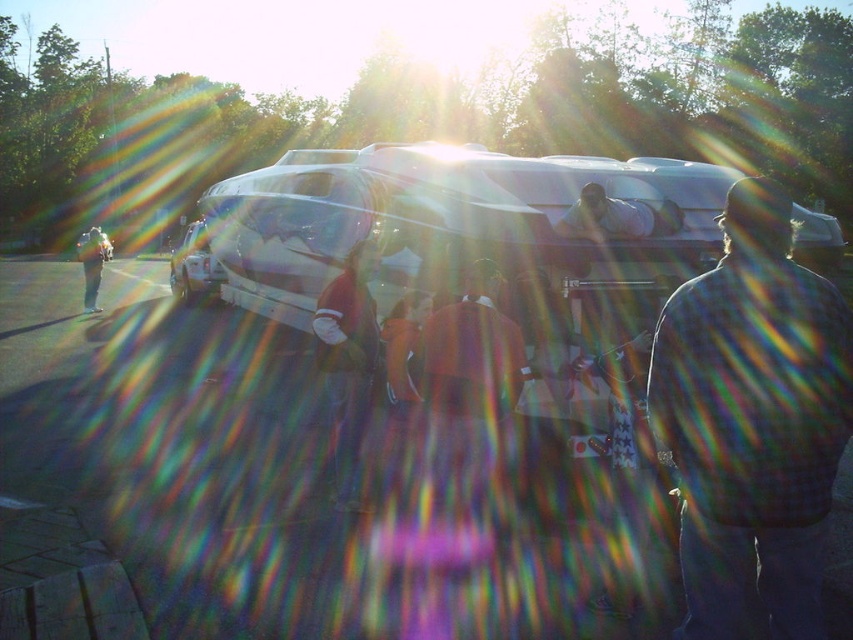
You are standing in the parking lot and see the orange fabric jacket at center and the light brown leather jacket at left. Which jacket is nearer to you?

The orange fabric jacket at center is closer to the viewer than the light brown leather jacket at left.

You are a photographer setting up a shoot in this outdoor evening scene. You have two props to place symmetrically on either side of the camera frame. The plaid shirt at right and the light brown leather jacket at left must be positioned so their edges align with the frame edges. Considering their widths, which prop should be placed closer to the center to maintain symmetry?

The plaid shirt at right is narrower than the light brown leather jacket at left. To maintain symmetry, the plaid shirt at right should be placed closer to the center since its smaller width requires less space compared to the wider light brown leather jacket at left.